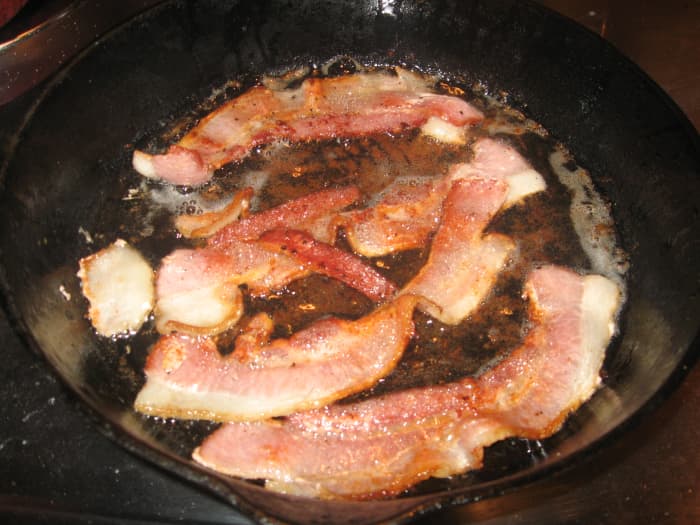
Locate an element on the screen. This screenshot has height=525, width=700. frying pan is located at coordinates (528, 63).